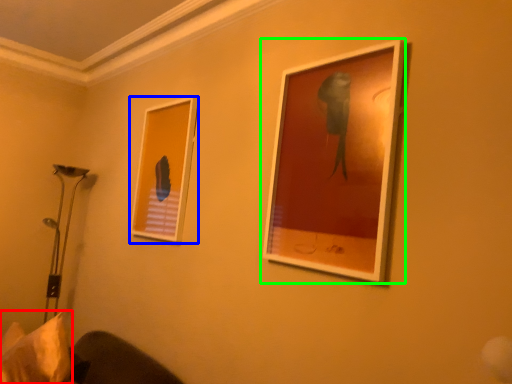
Question: Which is nearer to the pillow (highlighted by a red box)? picture frame (highlighted by a blue box) or picture frame (highlighted by a green box).

Choices:
 (A) picture frame
 (B) picture frame

Answer: (A)